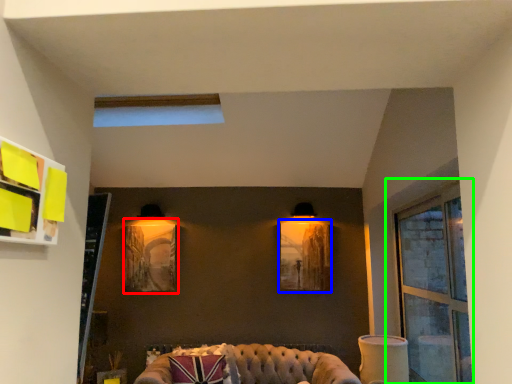
Question: Based on their relative distances, which object is nearer to picture frame (highlighted by a red box)? Choose from picture frame (highlighted by a blue box) and window (highlighted by a green box).

Choices:
 (A) picture frame
 (B) window

Answer: (A)